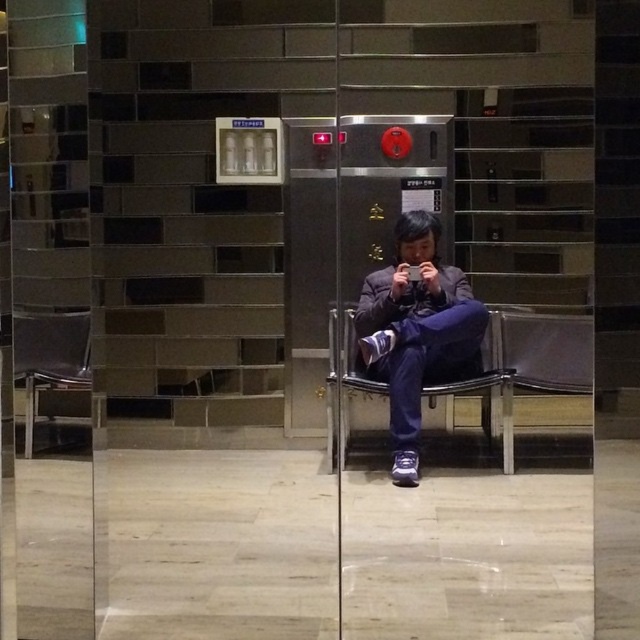
You are standing in the lobby and need to exit through the transparent glass door at center. Which direction should you move relative to the metallic silver chair at left to reach it?

The transparent glass door at center is to the right of the metallic silver chair at left, so you should move to the right of the metallic silver chair at left to reach it.

You are a guest in this lobby and want to sit down while charging your phone. The metallic silver chair at left has a built in USB port. Can you place your matte black phone at center on the chair?

The metallic silver chair at left is bigger than the matte black phone at center, so yes, you can place your matte black phone at center on the chair since it has enough space.

You are a guest in the lobby and need to place your matte black phone at center on the seat next to your matte purple pants at center. Is there enough space for both items side by side?

The matte purple pants at center is wider than the matte black phone at center. Since the pants are wider, there should be sufficient space to place both items side by side as long as the seat can accommodate the combined width of both objects.